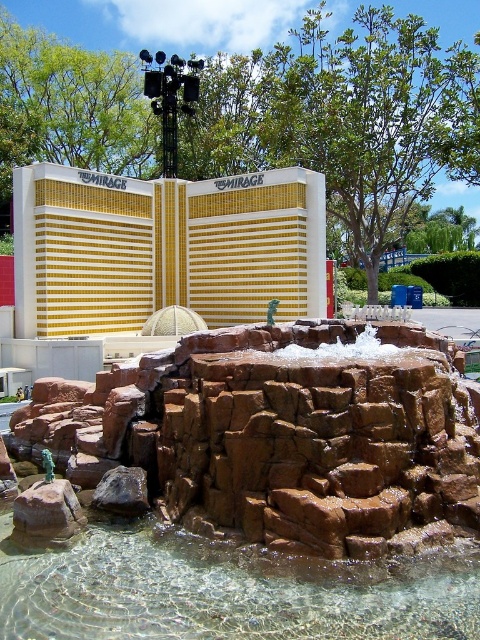
Describe the element at coordinates (164, 248) in the screenshot. I see `gold mosaic hotel at center` at that location.

Which is below, gold mosaic hotel at center or clear glass water at center?

clear glass water at center

Where is `gold mosaic hotel at center`? The height and width of the screenshot is (640, 480). gold mosaic hotel at center is located at coordinates (164, 248).